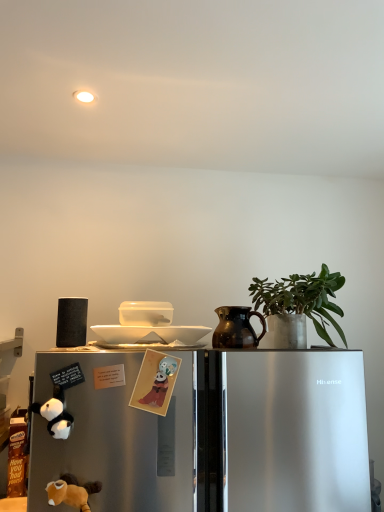
Question: From a real-world perspective, relative to sleek metallic refrigerator at lower left, is black plush toy at lower left, the 2th animal when ordered from bottom to top, vertically above or below?

Choices:
 (A) below
 (B) above

Answer: (B)

Question: Based on their positions, is black plush toy at lower left, the first animal in the left-to-right sequence, located to the left or right of sleek metallic refrigerator at lower left?

Choices:
 (A) right
 (B) left

Answer: (B)

Question: Which is nearer to the black plush toy at lower left, the 2th animal positioned from the top?

Choices:
 (A) green matte plant at upper right
 (B) soft plush toy at lower left, the 1th animal from the bottom
 (C) matte paper card at center, which is counted as the 3th animal, starting from the bottom
 (D) brown glazed jug at center
 (E) sleek metallic refrigerator at lower left

Answer: (B)

Question: Which of these objects is positioned closest to the brown glazed jug at center?

Choices:
 (A) soft plush toy at lower left, the 1th animal from the bottom
 (B) black matte speaker at left, the 1th appliance in the left-to-right sequence
 (C) black plush toy at lower left, the first animal in the left-to-right sequence
 (D) white glossy bowl at upper center, which appears as the first appliance when viewed from the right
 (E) sleek metallic refrigerator at lower left

Answer: (D)